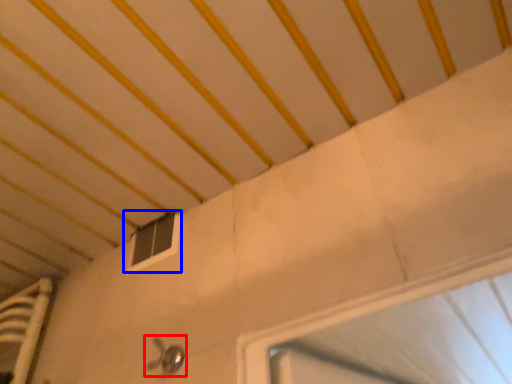
Question: Which point is closer to the camera, door handle (highlighted by a red box) or window (highlighted by a blue box)?

Choices:
 (A) door handle
 (B) window

Answer: (A)